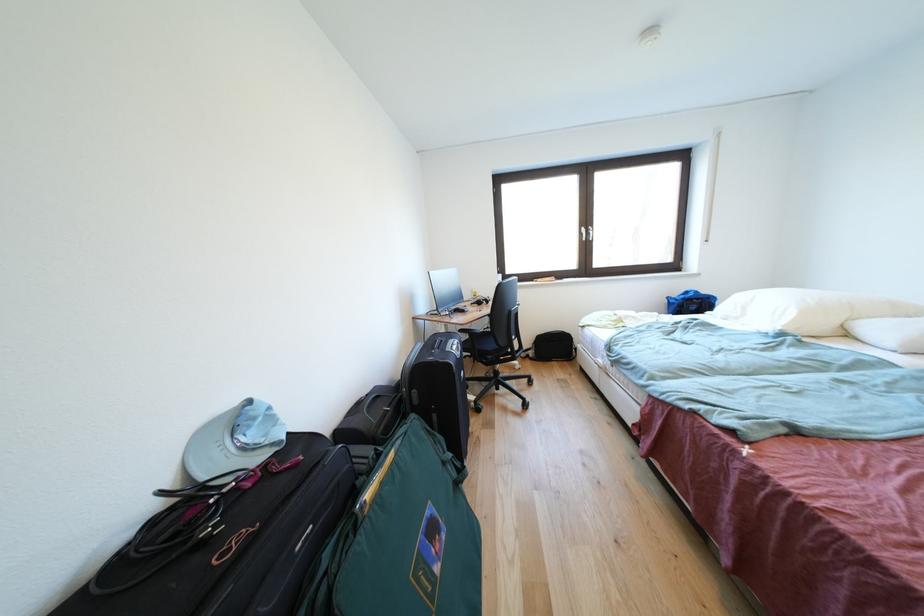
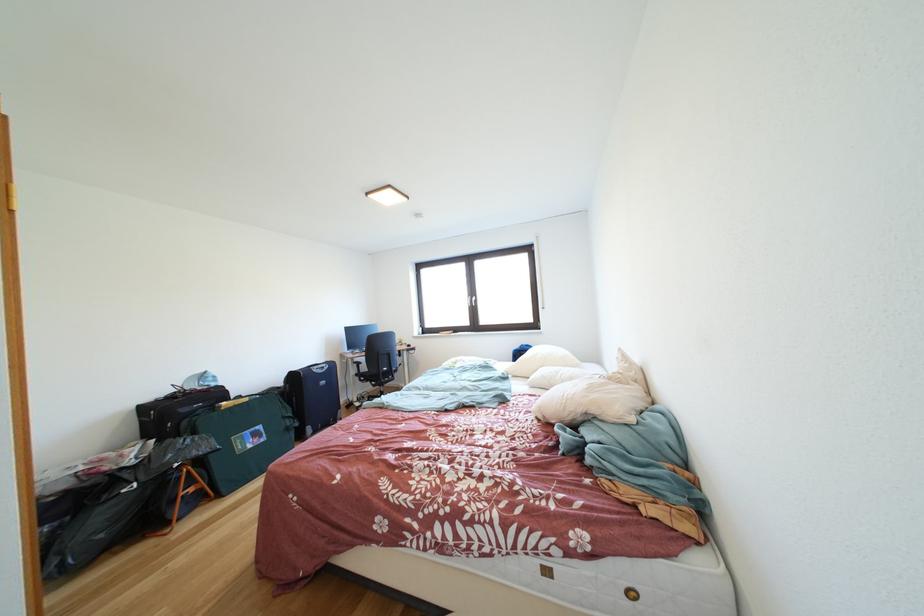
Which direction would the cameraman need to move to produce the second image?

The movement direction of the cameraman is right, backward.